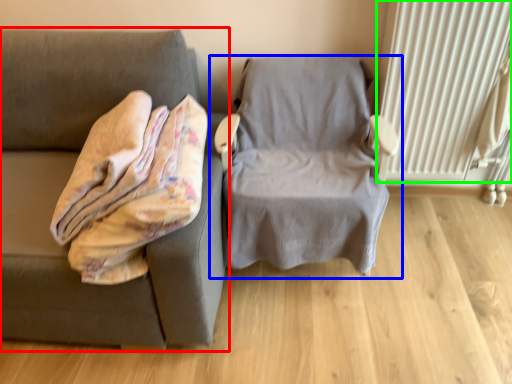
Question: Considering the real-world distances, which object is closest to studio couch (highlighted by a red box)? chair (highlighted by a blue box) or radiator (highlighted by a green box).

Choices:
 (A) chair
 (B) radiator

Answer: (A)